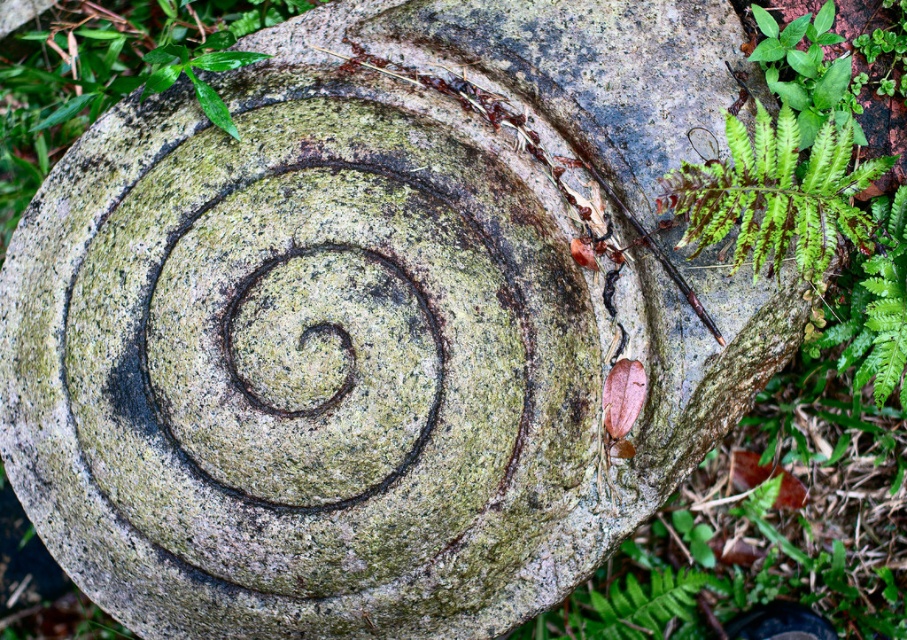
Does green leafy plant at center appear on the right side of green leafy fern at upper right?

Incorrect, green leafy plant at center is not on the right side of green leafy fern at upper right.

Can you confirm if green leafy plant at center is thinner than green leafy fern at upper right?

In fact, green leafy plant at center might be wider than green leafy fern at upper right.

Which is behind, point (275, 0) or point (671, 182)?

Positioned behind is point (275, 0).

Where is `green leafy plant at center`? Image resolution: width=907 pixels, height=640 pixels. green leafy plant at center is located at coordinates (101, 72).